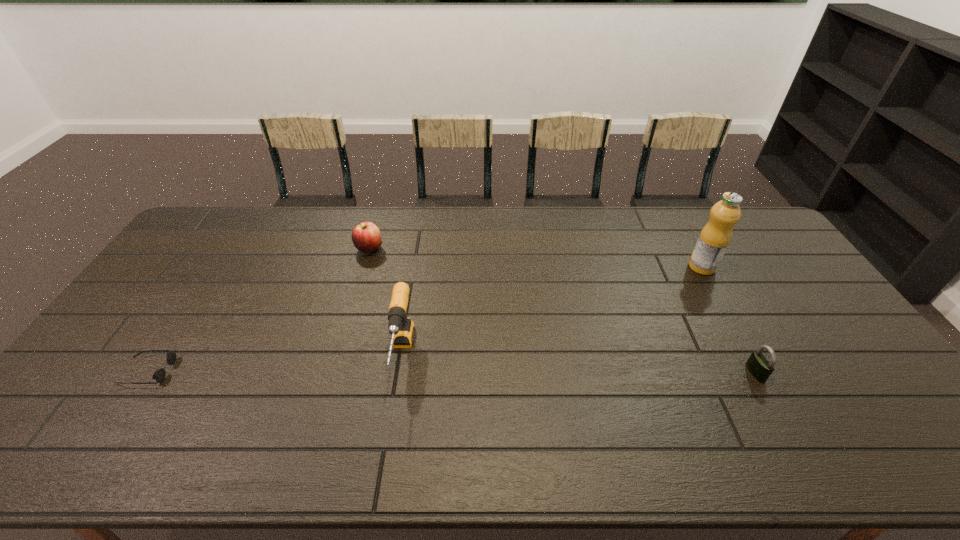
You are a GUI agent. You are given a task and a screenshot of the screen. Output one action in this format:
    pyautogui.click(x=<x>, y=<y>)
    Task: Click on the free location located on the front label of the fruit juice
    The height and width of the screenshot is (540, 960).
    Given the screenshot: What is the action you would take?
    pyautogui.click(x=616, y=267)

This screenshot has height=540, width=960. I want to click on free space located 0.180m on the front label of the fruit juice, so click(635, 267).

At what (x,y) coordinates should I click in order to perform the action: click on free space located 0.060m on the handle side of the second tallest object. Please return your answer as a coordinate pair (x, y). The image size is (960, 540). Looking at the image, I should click on (392, 418).

The image size is (960, 540). In order to click on vacant space located 0.050m on the left of the farthest object in this screenshot , I will do `click(341, 248)`.

In order to click on free space located on the back of the padlock in this screenshot , I will do `click(696, 264)`.

Identify the location of vacant space located 0.270m on the front-facing side of the leftmost object. (273, 371).

I want to click on object positioned at the far edge, so click(x=366, y=237).

Identify the location of object that is at the left edge. (159, 375).

The height and width of the screenshot is (540, 960). I want to click on free location at the far edge of the desktop, so click(x=430, y=245).

Where is `blank space at the near edge of the desktop`? The height and width of the screenshot is (540, 960). blank space at the near edge of the desktop is located at coordinates (338, 464).